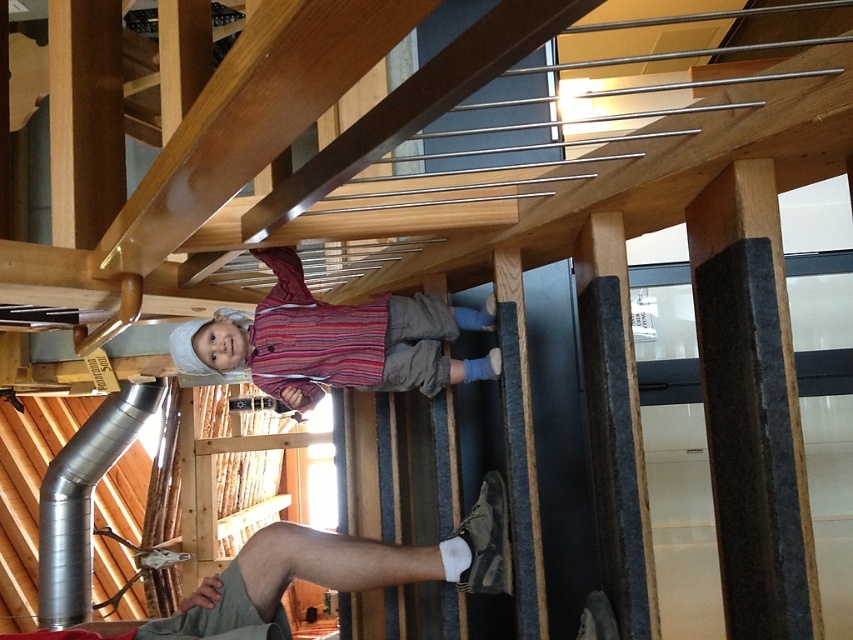
You are a photographer trying to capture the child in the image. You need to ensure the striped cotton shirt at center and the light brown fabric leg at lower center are both visible in the frame. Based on their positions, which object should you position closer to the left side of your camera viewfinder?

The light brown fabric leg at lower center should be positioned closer to the left side of the camera viewfinder because the striped cotton shirt at center is to the right of it.

You are a designer planning to install a new handrail on the staircase. You need to ensure that the space between the light brown fabric leg at lower center and the silver metallic duct at lower left is sufficient for a handrail. Given that the handrail requires a minimum of 10 cm of clearance on both sides, can you determine if the existing space between them allows for this installation?

The light brown fabric leg at lower center is wider than the silver metallic duct at lower left. However, the exact dimensions of the space between them are not provided in the description. To determine if the handrail can be installed with the required clearance, precise measurements of the distance between the two objects are needed.

You are a drone operator trying to navigate a small drone through a narrow passage between two points in the scene. The points are labeled as point 1 at coordinates point (355, 324) and point 2 at coordinates point (39, 604). Given that the drone can only fly straight and cannot turn, which point should you aim for first to ensure the shortest path to the other point?

Point 1 at coordinates point (355, 324) is closer to the viewer than point 2 at coordinates point (39, 604). Therefore, aiming for point 1 first ensures the shortest path as it is nearer to the starting position.